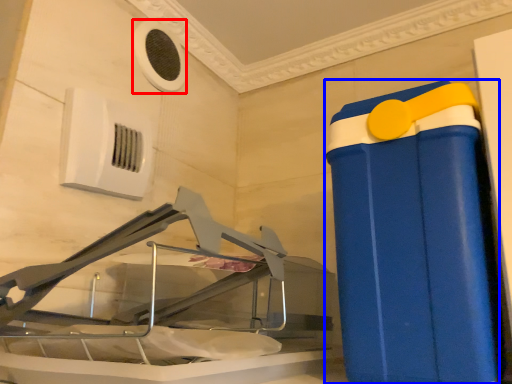
Question: Among these objects, which one is nearest to the camera, air conditioning (highlighted by a red box) or waste container (highlighted by a blue box)?

Choices:
 (A) air conditioning
 (B) waste container

Answer: (B)